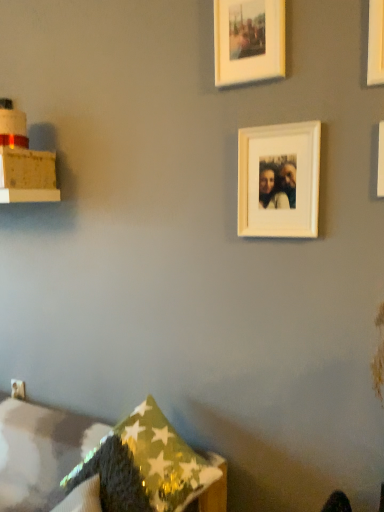
Question: Does shiny metallic pillow at lower center, marked as the 2th pillow in a front-to-back arrangement, have a greater height compared to white matte picture frame at upper center, the 1th picture frame in the top-to-bottom sequence?

Choices:
 (A) no
 (B) yes

Answer: (B)

Question: Does shiny metallic pillow at lower center, marked as the 2th pillow in a front-to-back arrangement, turn towards white matte picture frame at upper center, the 3th picture frame in the right-to-left sequence?

Choices:
 (A) yes
 (B) no

Answer: (B)

Question: Considering the relative sizes of shiny metallic pillow at lower center, the first pillow when ordered from back to front, and white matte picture frame at upper center, which is the 3th picture frame from bottom to top, in the image provided, is shiny metallic pillow at lower center, the first pillow when ordered from back to front, bigger than white matte picture frame at upper center, which is the 3th picture frame from bottom to top,?

Choices:
 (A) yes
 (B) no

Answer: (A)

Question: Would you consider shiny metallic pillow at lower center, the first pillow when ordered from back to front, to be distant from white matte picture frame at upper center, which is the first picture frame in left-to-right order?

Choices:
 (A) no
 (B) yes

Answer: (B)

Question: From a real-world perspective, is shiny metallic pillow at lower center, the first pillow when ordered from back to front, over white matte picture frame at upper center, the 1th picture frame in the top-to-bottom sequence?

Choices:
 (A) no
 (B) yes

Answer: (A)

Question: Considering the relative positions of green textured pillow at lower left, the 1th pillow viewed from the front, and white matte picture frame at upper right, the first picture frame from the right, in the image provided, is green textured pillow at lower left, the 1th pillow viewed from the front, to the left or to the right of white matte picture frame at upper right, the first picture frame from the right,?

Choices:
 (A) left
 (B) right

Answer: (A)

Question: From a real-world perspective, is green textured pillow at lower left, the 1th pillow viewed from the front, positioned above or below white matte picture frame at upper right, which appears as the 2th picture frame when viewed from the top?

Choices:
 (A) above
 (B) below

Answer: (B)

Question: Do you think green textured pillow at lower left, the 1th pillow viewed from the front, is within white matte picture frame at upper right, which appears as the 2th picture frame when viewed from the top, or outside of it?

Choices:
 (A) outside
 (B) inside

Answer: (A)

Question: Is green textured pillow at lower left, arranged as the second pillow when viewed from the back, taller or shorter than white matte picture frame at upper right, positioned as the second picture frame in bottom-to-top order?

Choices:
 (A) short
 (B) tall

Answer: (B)

Question: Does point (140, 504) appear closer or farther from the camera than point (256, 1)?

Choices:
 (A) farther
 (B) closer

Answer: (B)

Question: Is green textured pillow at lower left, arranged as the second pillow when viewed from the back, inside or outside of white matte picture frame at upper center, which is the first picture frame in left-to-right order?

Choices:
 (A) inside
 (B) outside

Answer: (B)

Question: In the image, is green textured pillow at lower left, the 1th pillow viewed from the front, positioned in front of or behind white matte picture frame at upper center, which is the 3th picture frame from bottom to top?

Choices:
 (A) behind
 (B) front

Answer: (B)

Question: Is green textured pillow at lower left, arranged as the second pillow when viewed from the back, to the left or to the right of white matte picture frame at upper center, the 1th picture frame in the top-to-bottom sequence, in the image?

Choices:
 (A) left
 (B) right

Answer: (A)

Question: In the image, is green textured pillow at lower left, arranged as the second pillow when viewed from the back, positioned in front of or behind shiny metallic pillow at lower center, marked as the 2th pillow in a front-to-back arrangement?

Choices:
 (A) behind
 (B) front

Answer: (B)

Question: From the image's perspective, is green textured pillow at lower left, the 1th pillow viewed from the front, above or below shiny metallic pillow at lower center, marked as the 2th pillow in a front-to-back arrangement?

Choices:
 (A) below
 (B) above

Answer: (B)